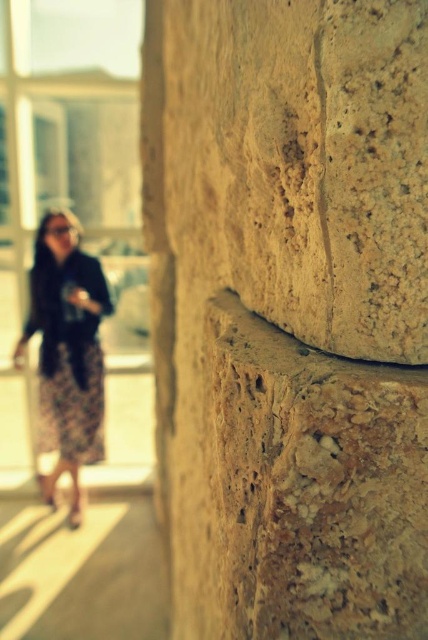
Question: Can you confirm if natural stone wall at right is positioned to the right of floral skirt at left?

Choices:
 (A) no
 (B) yes

Answer: (B)

Question: Does natural stone wall at right have a larger size compared to floral skirt at left?

Choices:
 (A) no
 (B) yes

Answer: (B)

Question: Which of the following is the closest to the observer?

Choices:
 (A) floral skirt at left
 (B) natural stone wall at right

Answer: (B)

Question: Which of the following is the closest to the observer?

Choices:
 (A) pos(98,449)
 (B) pos(220,324)

Answer: (B)

Question: Does natural stone wall at right appear on the left side of floral skirt at left?

Choices:
 (A) yes
 (B) no

Answer: (B)